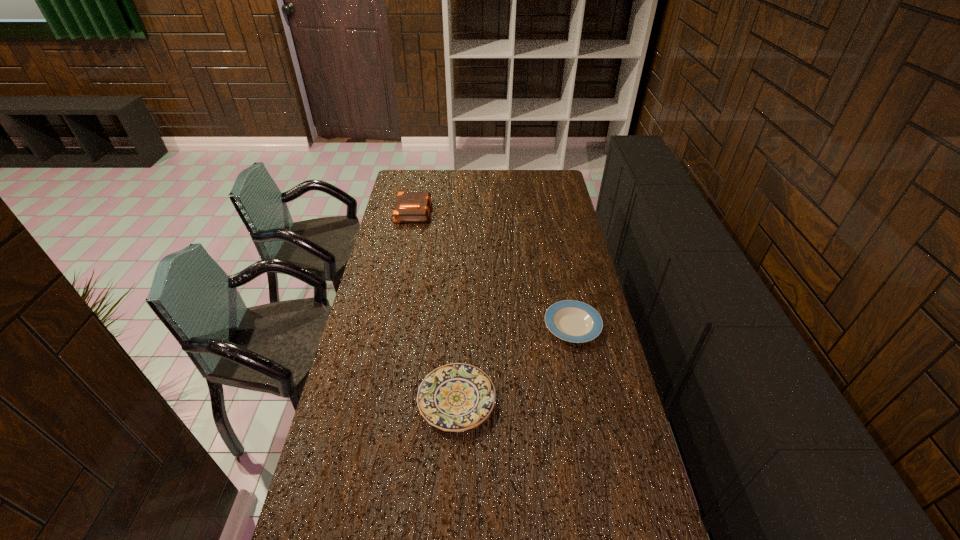
What are the coordinates of `object positioned at the right edge` in the screenshot? It's located at (570, 320).

Find the location of a particular element. The width and height of the screenshot is (960, 540). blank space at the far edge is located at coordinates (482, 184).

At what (x,y) coordinates should I click in order to perform the action: click on free spot at the left edge of the desktop. Please return your answer as a coordinate pair (x, y). The image size is (960, 540). Looking at the image, I should click on (363, 348).

This screenshot has height=540, width=960. I want to click on blank space at the right edge of the desktop, so click(x=584, y=401).

You are a GUI agent. You are given a task and a screenshot of the screen. Output one action in this format:
    pyautogui.click(x=<x>, y=<y>)
    Task: Click on the free space at the far right corner of the desktop
    Image resolution: width=960 pixels, height=540 pixels.
    Given the screenshot: What is the action you would take?
    pyautogui.click(x=542, y=192)

The width and height of the screenshot is (960, 540). I want to click on unoccupied area between the farthest object and the second object from left to right, so point(435,305).

I want to click on vacant point located between the second farthest object and the nearest object, so click(x=515, y=362).

Identify the location of unoccupied position between the second farthest object and the Bible. The image size is (960, 540). (493, 268).

The height and width of the screenshot is (540, 960). Find the location of `free space between the nearest object and the rightmost object`. free space between the nearest object and the rightmost object is located at coordinates (515, 362).

Identify the location of free space that is in between the farthest object and the farther plate. The width and height of the screenshot is (960, 540). (493, 268).